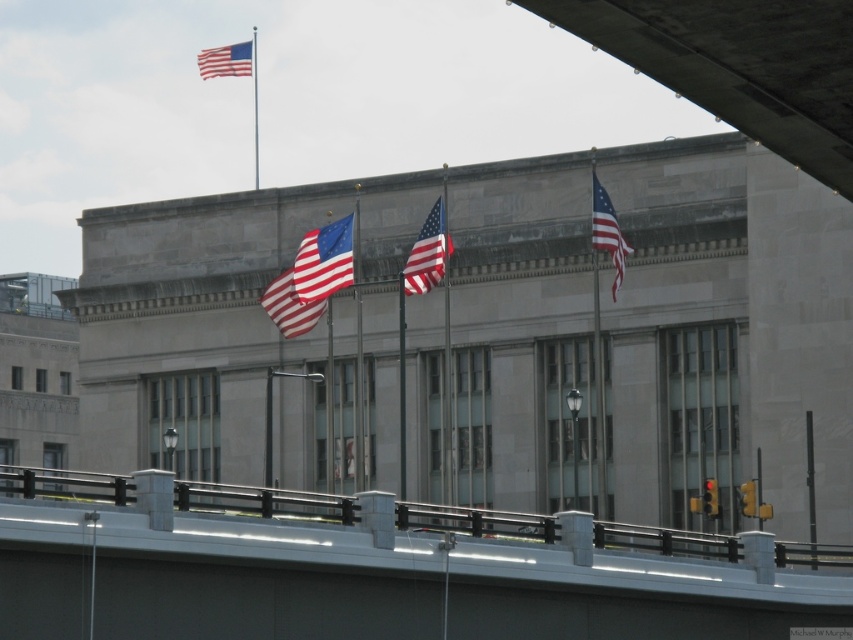
Question: From the image, what is the correct spatial relationship of concrete bridge at center in relation to matte fabric flag at upper right?

Choices:
 (A) right
 (B) left

Answer: (B)

Question: Does concrete bridge at center appear under matte blue flag at center?

Choices:
 (A) no
 (B) yes

Answer: (B)

Question: Can you confirm if concrete bridge at center is positioned to the left of matte red-white-blue flag at center?

Choices:
 (A) no
 (B) yes

Answer: (A)

Question: Which point is farther from the camera taking this photo?

Choices:
 (A) (202, 68)
 (B) (444, 243)

Answer: (A)

Question: Which point is closer to the camera?

Choices:
 (A) matte fabric flag at upper right
 (B) polished metal flag pole at upper center

Answer: (A)

Question: Among these points, which one is nearest to the camera?

Choices:
 (A) (x=601, y=458)
 (B) (x=283, y=289)
 (C) (x=354, y=484)
 (D) (x=257, y=160)

Answer: (A)